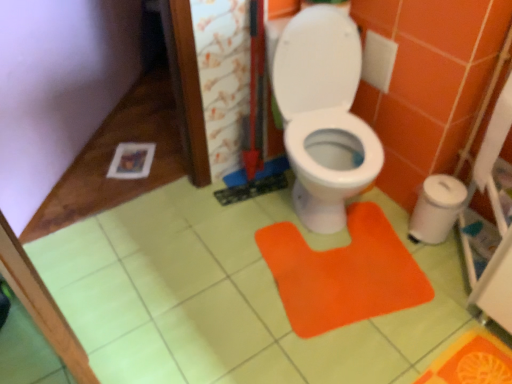
Question: Choose the correct answer: Is white plastic trash can at right inside orange fabric doormat at center or outside it?

Choices:
 (A) outside
 (B) inside

Answer: (A)

Question: Considering the positions of white plastic trash can at right and orange fabric doormat at center in the image, is white plastic trash can at right wider or thinner than orange fabric doormat at center?

Choices:
 (A) thin
 (B) wide

Answer: (A)

Question: Which object is the farthest from the white paper at right?

Choices:
 (A) orange fabric doormat at center
 (B) white plastic trash can at right

Answer: (A)

Question: Which object is positioned closest to the white plastic trash can at right?

Choices:
 (A) orange fabric doormat at center
 (B) white paper at right

Answer: (B)